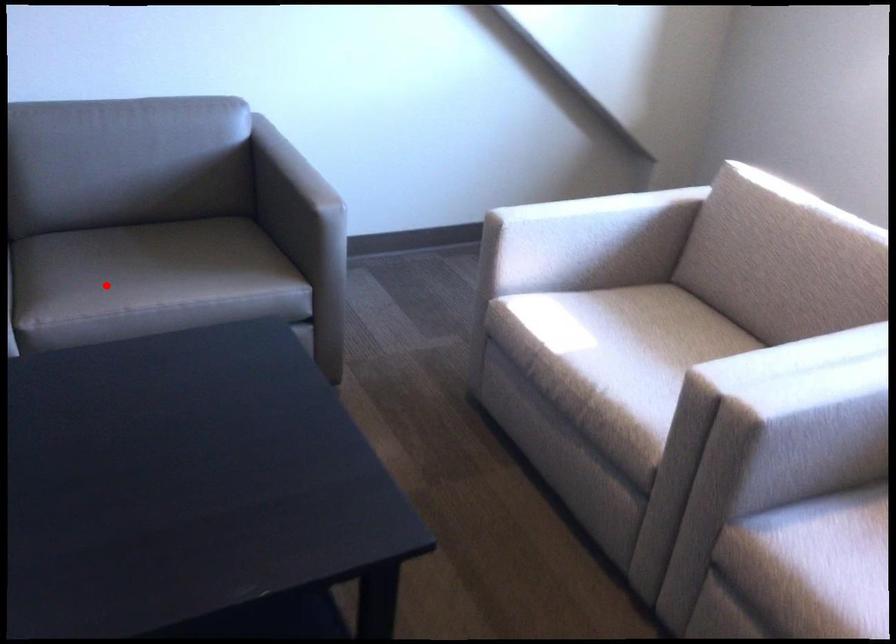
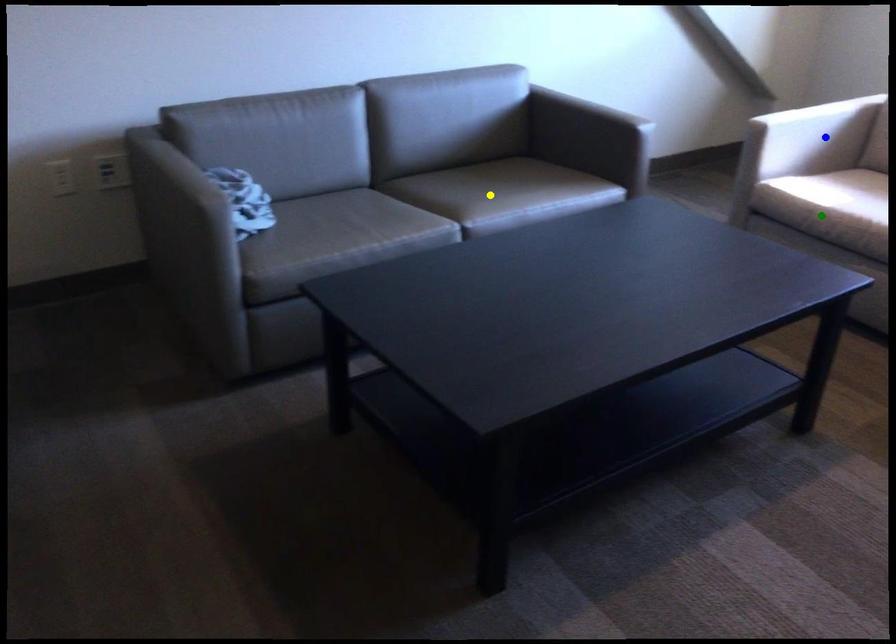
Question: I am providing you with two images of the same scene from different viewpoints. A red point is marked on the first image. You are given multiple points on the second image. In image 2, which mark is for the same physical point as the one in image 1?

Choices:
 (A) green point
 (B) blue point
 (C) yellow point

Answer: (C)